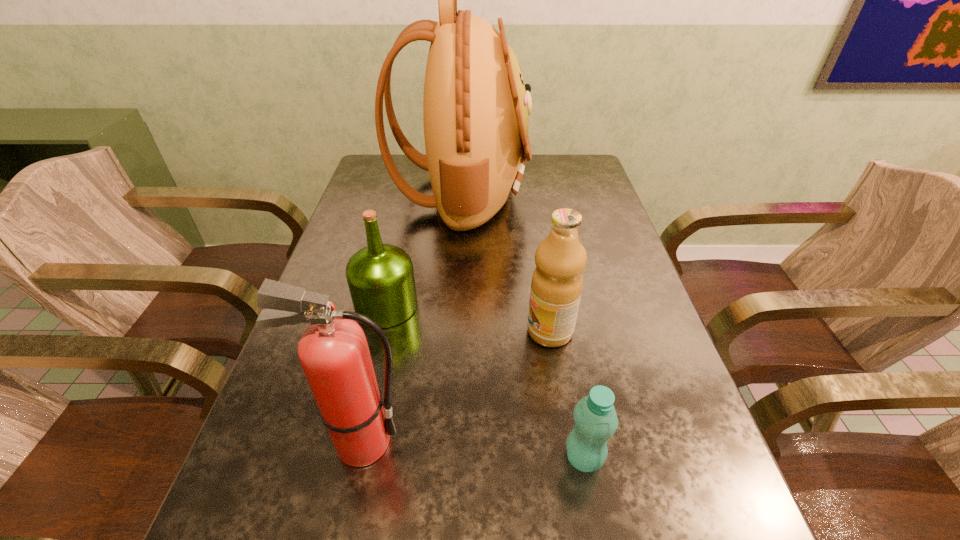
Identify the location of backpack. (475, 108).

Identify the location of the tallest object. The height and width of the screenshot is (540, 960). (475, 108).

Where is `the second tallest object`? This screenshot has height=540, width=960. the second tallest object is located at coordinates pos(333,351).

I want to click on the taller olive oil, so click(x=557, y=282).

Find the location of a particular element. The image size is (960, 540). the right olive oil is located at coordinates (557, 282).

You are a GUI agent. You are given a task and a screenshot of the screen. Output one action in this format:
    pyautogui.click(x=<x>, y=<y>)
    Task: Click on the left olive oil
    Image resolution: width=960 pixels, height=540 pixels.
    Given the screenshot: What is the action you would take?
    pyautogui.click(x=380, y=277)

Where is `the shorter olive oil`? the shorter olive oil is located at coordinates (380, 277).

What are the coordinates of `bottle` in the screenshot? It's located at (596, 421).

Image resolution: width=960 pixels, height=540 pixels. I want to click on vacant area situated on the front-facing side of the backpack, so click(600, 193).

The height and width of the screenshot is (540, 960). Identify the location of vacant space located 0.350m on the hose direction of the fire extinguisher. (612, 442).